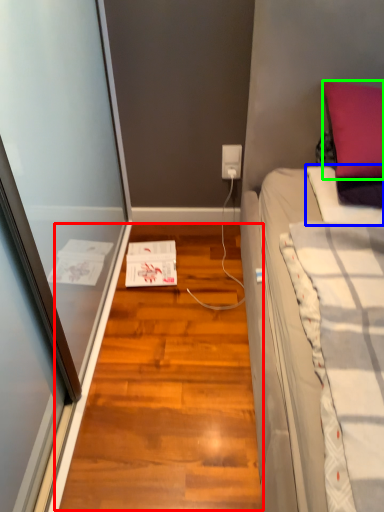
Question: Which object is the farthest from hardwood (highlighted by a red box)? Choose among these: blanket (highlighted by a blue box) or pillow (highlighted by a green box).

Choices:
 (A) blanket
 (B) pillow

Answer: (B)